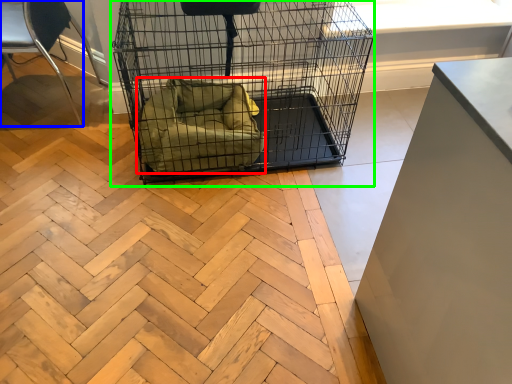
Question: Which object is the farthest from dog bed (highlighted by a red box)? Choose among these: chair (highlighted by a blue box) or bird cage (highlighted by a green box).

Choices:
 (A) chair
 (B) bird cage

Answer: (A)